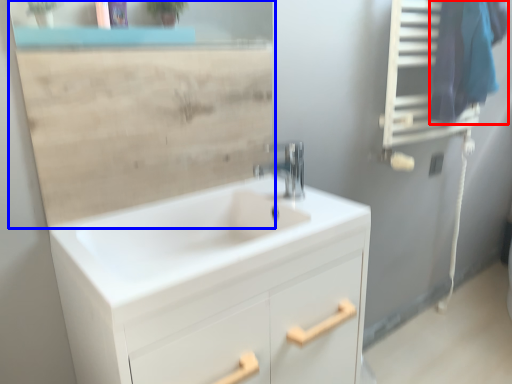
Question: Which of the following is the closest to the observer, laundry (highlighted by a red box) or mirror (highlighted by a blue box)?

Choices:
 (A) laundry
 (B) mirror

Answer: (B)